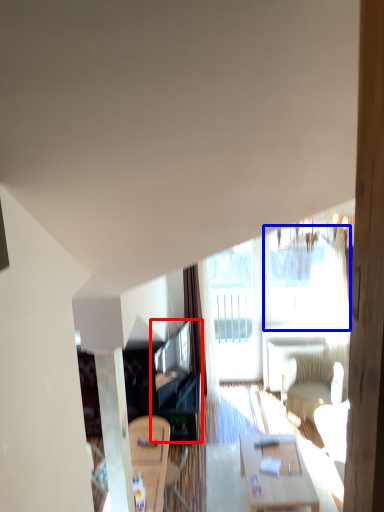
Question: Among these objects, which one is farthest to the camera, entertainment center (highlighted by a red box) or window (highlighted by a blue box)?

Choices:
 (A) entertainment center
 (B) window

Answer: (B)